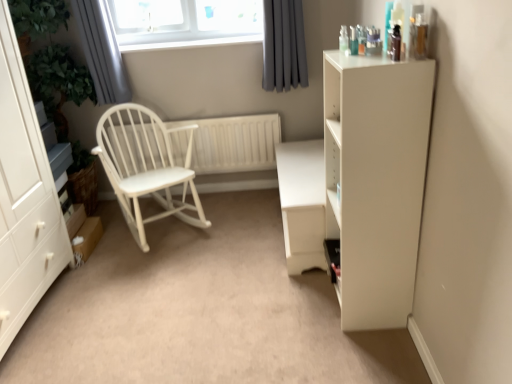
Identify the location of free spot in front of white matte table at center. (274, 300).